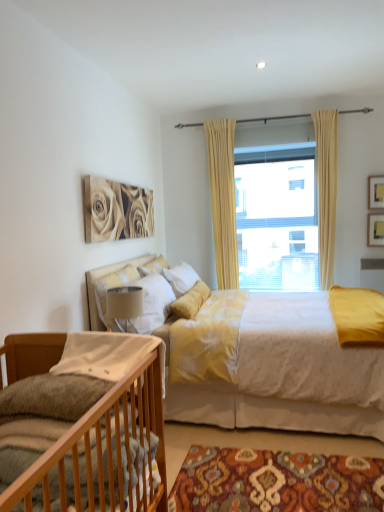
The height and width of the screenshot is (512, 384). What do you see at coordinates (153, 266) in the screenshot?
I see `white soft pillow at upper center, which appears as the 4th pillow when viewed from the front` at bounding box center [153, 266].

The height and width of the screenshot is (512, 384). What do you see at coordinates (375, 230) in the screenshot?
I see `wooden picture frame at upper right, the 2th picture frame when ordered from top to bottom` at bounding box center [375, 230].

I want to click on white fabric pillow at left, the third pillow positioned from the front, so click(100, 277).

What do you see at coordinates (100, 277) in the screenshot? The image size is (384, 512). I see `white fabric pillow at left, the third pillow positioned from the front` at bounding box center [100, 277].

What do you see at coordinates (223, 200) in the screenshot? I see `yellow fabric curtain at center, which appears as the 1th curtain when viewed from the left` at bounding box center [223, 200].

What is the approximate height of beige fabric curtain at center?

beige fabric curtain at center is 1.78 meters tall.

Find the location of a particular element. Image resolution: width=384 pixels, height=512 pixels. velvet yellow bed at center, which is counted as the 2th bed, starting from the front is located at coordinates (283, 375).

Is beige fabric curtain at upper center, acting as the 2th curtain starting from the left, facing away from patterned carpet at lower center?

beige fabric curtain at upper center, acting as the 2th curtain starting from the left, does not have its back to patterned carpet at lower center.

Between point (327, 207) and point (302, 476), which one is positioned behind?

The point (327, 207) is behind.

From a real-world perspective, is beige fabric curtain at upper center, the 1th curtain viewed from the right, above or below patterned carpet at lower center?

In terms of real-world spatial position, beige fabric curtain at upper center, the 1th curtain viewed from the right, is above patterned carpet at lower center.

Who is bigger, beige fabric curtain at upper center, acting as the 2th curtain starting from the left, or patterned carpet at lower center?

beige fabric curtain at upper center, acting as the 2th curtain starting from the left.

From the image's perspective, relative to white fabric pillow at left, the third pillow positioned from the front, is patterned carpet at lower center above or below?

patterned carpet at lower center is situated lower than white fabric pillow at left, the third pillow positioned from the front, in the image.

Considering the relative positions of patterned carpet at lower center and white fabric pillow at left, placed as the 2th pillow when sorted from back to front, in the image provided, is patterned carpet at lower center behind white fabric pillow at left, placed as the 2th pillow when sorted from back to front,?

No, patterned carpet at lower center is closer to the viewer.

Do you think patterned carpet at lower center is within white fabric pillow at left, the third pillow positioned from the front, or outside of it?

patterned carpet at lower center is not inside white fabric pillow at left, the third pillow positioned from the front, it's outside.

Can you see wooden picture frame at upper right, arranged as the 1th picture frame when viewed from the top, touching velvet yellow bed at center, which is the first bed in back-to-front order?

No, wooden picture frame at upper right, arranged as the 1th picture frame when viewed from the top, is not making contact with velvet yellow bed at center, which is the first bed in back-to-front order.

Which object is wider, wooden picture frame at upper right, arranged as the 1th picture frame when viewed from the top, or velvet yellow bed at center, which is the first bed in back-to-front order?

Wider between the two is velvet yellow bed at center, which is the first bed in back-to-front order.

Is wooden picture frame at upper right, arranged as the 1th picture frame when viewed from the top, not within velvet yellow bed at center, which is the first bed in back-to-front order?

Yes, wooden picture frame at upper right, arranged as the 1th picture frame when viewed from the top, is located beyond the bounds of velvet yellow bed at center, which is the first bed in back-to-front order.

Is wooden picture frame at upper right, arranged as the 1th picture frame when viewed from the top, facing away from velvet yellow bed at center, which is counted as the 2th bed, starting from the front?

wooden picture frame at upper right, arranged as the 1th picture frame when viewed from the top, does not have its back to velvet yellow bed at center, which is counted as the 2th bed, starting from the front.

Would you say white soft pillow at upper center, the 1th pillow in the back-to-front sequence, is outside velvet yellow bed at center, which is counted as the 2th bed, starting from the front?

No.

Does white soft pillow at upper center, the 1th pillow in the back-to-front sequence, turn towards velvet yellow bed at center, which is the first bed in back-to-front order?

Yes, white soft pillow at upper center, the 1th pillow in the back-to-front sequence, is aimed at velvet yellow bed at center, which is the first bed in back-to-front order.

Does white soft pillow at upper center, the 1th pillow in the back-to-front sequence, have a lesser height compared to velvet yellow bed at center, which is the first bed in back-to-front order?

Correct, white soft pillow at upper center, the 1th pillow in the back-to-front sequence, is not as tall as velvet yellow bed at center, which is the first bed in back-to-front order.

Are white soft pillow at upper center, which appears as the 4th pillow when viewed from the front, and velvet yellow bed at center, which is the first bed in back-to-front order, far apart?

Yes, white soft pillow at upper center, which appears as the 4th pillow when viewed from the front, and velvet yellow bed at center, which is the first bed in back-to-front order, are located far from each other.

Is white cotton pillow at lower left, the third pillow when ordered from back to front, beside yellow fabric curtain at center, which is the second curtain from right to left?

No, white cotton pillow at lower left, the third pillow when ordered from back to front, is not beside yellow fabric curtain at center, which is the second curtain from right to left.

Which is behind, white cotton pillow at lower left, which is the second pillow from front to back, or yellow fabric curtain at center, which appears as the 1th curtain when viewed from the left?

yellow fabric curtain at center, which appears as the 1th curtain when viewed from the left, is further away from the camera.

Is white cotton pillow at lower left, the third pillow when ordered from back to front, situated inside yellow fabric curtain at center, which appears as the 1th curtain when viewed from the left, or outside?

white cotton pillow at lower left, the third pillow when ordered from back to front, is outside yellow fabric curtain at center, which appears as the 1th curtain when viewed from the left.

Does point (112, 349) come closer to viewer compared to point (226, 231)?

Yes.

What's the angular difference between wooden picture frame at upper right, which is the second picture frame in bottom-to-top order, and wooden crib at lower left, which is the 1th bed in front-to-back order,'s facing directions?

The angle between the facing direction of wooden picture frame at upper right, which is the second picture frame in bottom-to-top order, and the facing direction of wooden crib at lower left, which is the 1th bed in front-to-back order, is 90 degrees.

Could you measure the distance between wooden picture frame at upper right, arranged as the 1th picture frame when viewed from the top, and wooden crib at lower left, which is the 1th bed in front-to-back order?

A distance of 3.49 meters exists between wooden picture frame at upper right, arranged as the 1th picture frame when viewed from the top, and wooden crib at lower left, which is the 1th bed in front-to-back order.

From a real-world perspective, is wooden picture frame at upper right, which is the second picture frame in bottom-to-top order, below wooden crib at lower left, which is the 1th bed in front-to-back order?

No.

Which of these two, wooden picture frame at upper right, arranged as the 1th picture frame when viewed from the top, or wooden crib at lower left, which is the second bed in back-to-front order, stands taller?

With more height is wooden crib at lower left, which is the second bed in back-to-front order.

What are the coordinates of `pillow that is the 2nd one when counting upward from the wooden crib at lower left, which is the 1th bed in front-to-back order (from the image's perspective)` in the screenshot? It's located at (107, 354).

Would you say wooden crib at lower left, which is the 1th bed in front-to-back order, is inside or outside white cotton pillow at lower left, the third pillow when ordered from back to front?

wooden crib at lower left, which is the 1th bed in front-to-back order, cannot be found inside white cotton pillow at lower left, the third pillow when ordered from back to front.

Is wooden crib at lower left, which is the second bed in back-to-front order, oriented towards white cotton pillow at lower left, the third pillow when ordered from back to front?

No, wooden crib at lower left, which is the second bed in back-to-front order, is not aimed at white cotton pillow at lower left, the third pillow when ordered from back to front.

Where is `mat in front of the beige fabric curtain at upper center, acting as the 2th curtain starting from the left`? This screenshot has height=512, width=384. mat in front of the beige fabric curtain at upper center, acting as the 2th curtain starting from the left is located at coordinates (276, 482).

At what (x,y) coordinates should I click in order to perform the action: click on the 3rd pillow above the patterned carpet at lower center (from the image's perspective). Please return your answer as a coordinate pair (x, y). This screenshot has width=384, height=512. Looking at the image, I should click on (100, 277).

Looking at the image, which one is located closer to wooden crib at lower left, which is the 1th bed in front-to-back order, wooden picture frame at upper right, the 2th picture frame when ordered from top to bottom, or white cotton pillow at lower left, the third pillow when ordered from back to front?

Based on the image, white cotton pillow at lower left, the third pillow when ordered from back to front, appears to be nearer to wooden crib at lower left, which is the 1th bed in front-to-back order.

From the image, which object appears to be nearer to patterned carpet at lower center, yellow fabric curtain at center, which appears as the 1th curtain when viewed from the left, or white fabric pillow at left, the third pillow positioned from the front?

white fabric pillow at left, the third pillow positioned from the front.

From the image, which object appears to be nearer to white fabric pillow at left, placed as the 2th pillow when sorted from back to front, wooden crib at lower left, which is the second bed in back-to-front order, or white soft pillow at upper center, which appears as the 4th pillow when viewed from the front?

white soft pillow at upper center, which appears as the 4th pillow when viewed from the front, is closer to white fabric pillow at left, placed as the 2th pillow when sorted from back to front.

Based on their spatial positions, is yellow fabric curtain at center, which appears as the 1th curtain when viewed from the left, or wooden picture frame at upper right, which is the second picture frame in bottom-to-top order, closer to white fabric pillow at left, placed as the 2th pillow when sorted from back to front?

Among the two, yellow fabric curtain at center, which appears as the 1th curtain when viewed from the left, is located nearer to white fabric pillow at left, placed as the 2th pillow when sorted from back to front.

Considering their positions, is beige fabric curtain at center positioned further to soft gray knit pillow at lower left, arranged as the 1th pillow when viewed from the front, than wooden crib at lower left, which is the second bed in back-to-front order?

beige fabric curtain at center lies further to soft gray knit pillow at lower left, arranged as the 1th pillow when viewed from the front, than the other object.

Which object lies nearer to the anchor point patterned carpet at lower center, velvet yellow bed at center, which is the first bed in back-to-front order, or white fabric pillow at left, the third pillow positioned from the front?

Among the two, velvet yellow bed at center, which is the first bed in back-to-front order, is located nearer to patterned carpet at lower center.

Estimate the real-world distances between objects in this image. Which object is further from beige fabric curtain at upper center, acting as the 2th curtain starting from the left, wooden picture frame at upper right, which is the second picture frame in bottom-to-top order, or velvet yellow bed at center, which is counted as the 2th bed, starting from the front?

Based on the image, velvet yellow bed at center, which is counted as the 2th bed, starting from the front, appears to be further to beige fabric curtain at upper center, acting as the 2th curtain starting from the left.

Based on the photo, from the image, which object appears to be nearer to white soft pillow at upper center, the 1th pillow in the back-to-front sequence, wooden crib at lower left, which is the 1th bed in front-to-back order, or beige fabric curtain at upper center, the 1th curtain viewed from the right?

beige fabric curtain at upper center, the 1th curtain viewed from the right, lies closer to white soft pillow at upper center, the 1th pillow in the back-to-front sequence, than the other object.

Locate an element on the screen. This screenshot has height=512, width=384. picture frame between wooden crib at lower left, which is the 1th bed in front-to-back order, and wooden picture frame at upper right, the 2th picture frame when ordered from top to bottom, from front to back is located at coordinates (376, 192).

Where is `bed between white cotton pillow at lower left, which is the second pillow from front to back, and white soft pillow at upper center, which appears as the 4th pillow when viewed from the front, from front to back`? This screenshot has width=384, height=512. bed between white cotton pillow at lower left, which is the second pillow from front to back, and white soft pillow at upper center, which appears as the 4th pillow when viewed from the front, from front to back is located at coordinates (283, 375).

The height and width of the screenshot is (512, 384). What are the coordinates of `bed between white cotton pillow at lower left, which is the second pillow from front to back, and beige fabric curtain at upper center, acting as the 2th curtain starting from the left, from front to back` in the screenshot? It's located at (283, 375).

The height and width of the screenshot is (512, 384). Identify the location of mat positioned between soft gray knit pillow at lower left, arranged as the 1th pillow when viewed from the front, and wooden picture frame at upper right, which is the second picture frame in bottom-to-top order, from near to far. (276, 482).